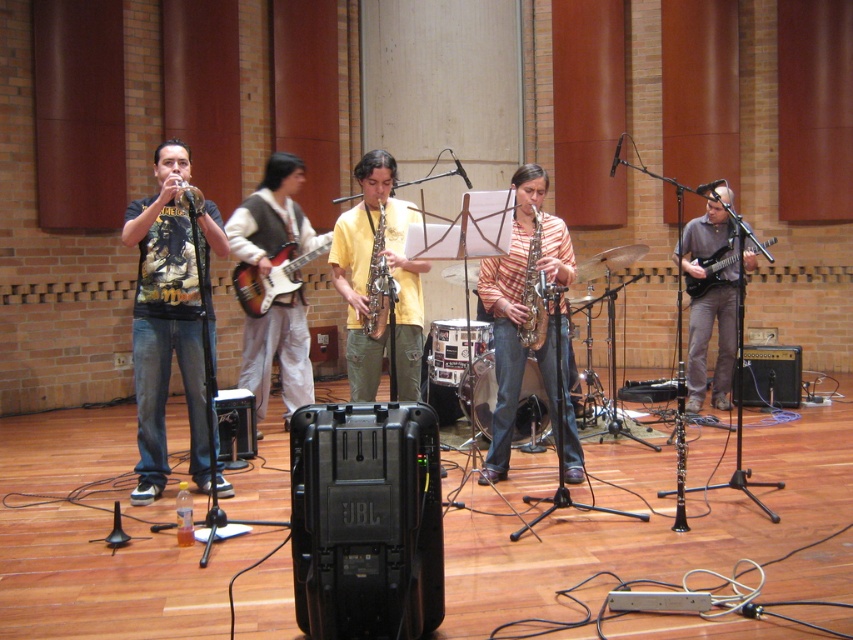
You are a stagehand setting up a music performance. You need to place a 1.2 meter wide equipment box between the metallic silver drum at center and the metallic electric guitar at right. Is there enough space between them to fit the box?

The metallic silver drum at center is wider than the metallic electric guitar at right. However, the exact distance between them isn

You are a photographer positioned at the back of the studio. You need to capture a photo that includes both the metallic silver drum at center and the metallic electric guitar at right. Based on their positions, which one should you focus on first to ensure both are in frame?

The metallic silver drum at center is below the metallic electric guitar at right, so you should focus on the metallic electric guitar at right first to ensure both are in frame.

You are standing in the studio and want to place a new microphone directly above the matte black trumpet at left. According to the coordinates provided, where should you position the microphone in terms of X and Y coordinates?

The matte black trumpet at left is located at coordinates X 0.686 and Y 0.179, so you should position the microphone at the same X coordinate, 0.686, and slightly above the Y coordinate, perhaps at Y 0.200 to ensure proper placement.